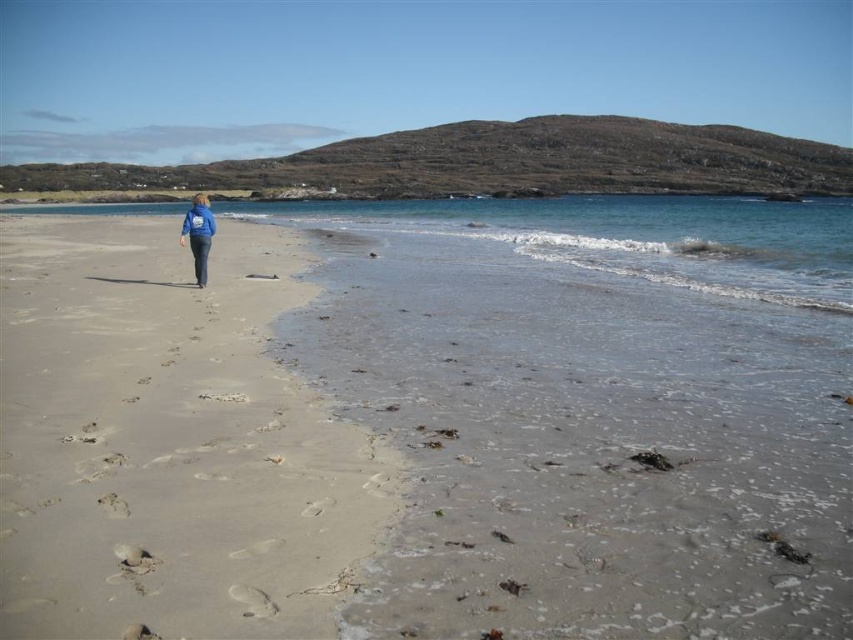
Who is taller, light beige sand at left or blue fabric jacket at center?

blue fabric jacket at center is taller.

Between point (229, 560) and point (183, 230), which one is positioned behind?

The point (183, 230) is behind.

Measure the distance between light beige sand at left and camera.

They are 3.03 meters apart.

Find the location of `light beige sand at left`. light beige sand at left is located at coordinates (169, 440).